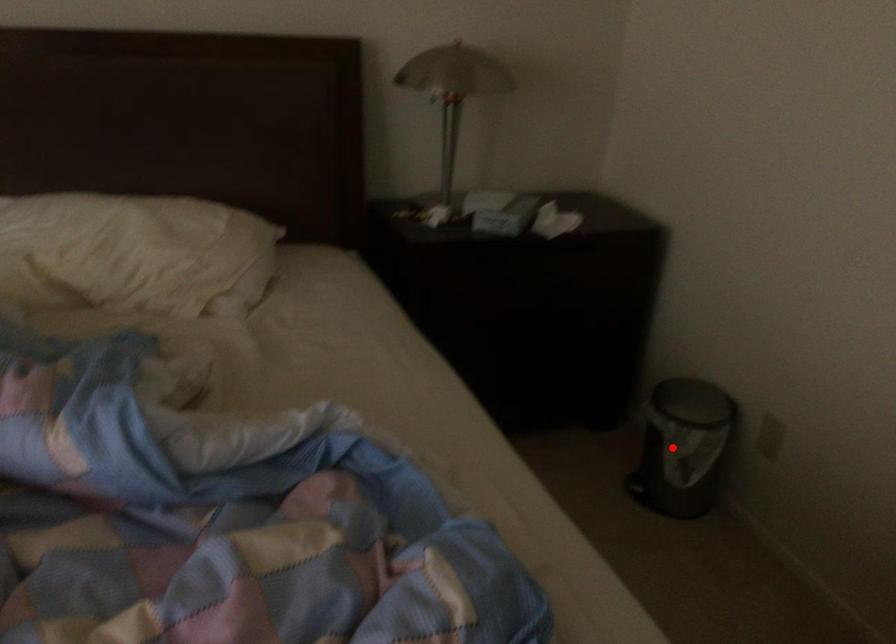
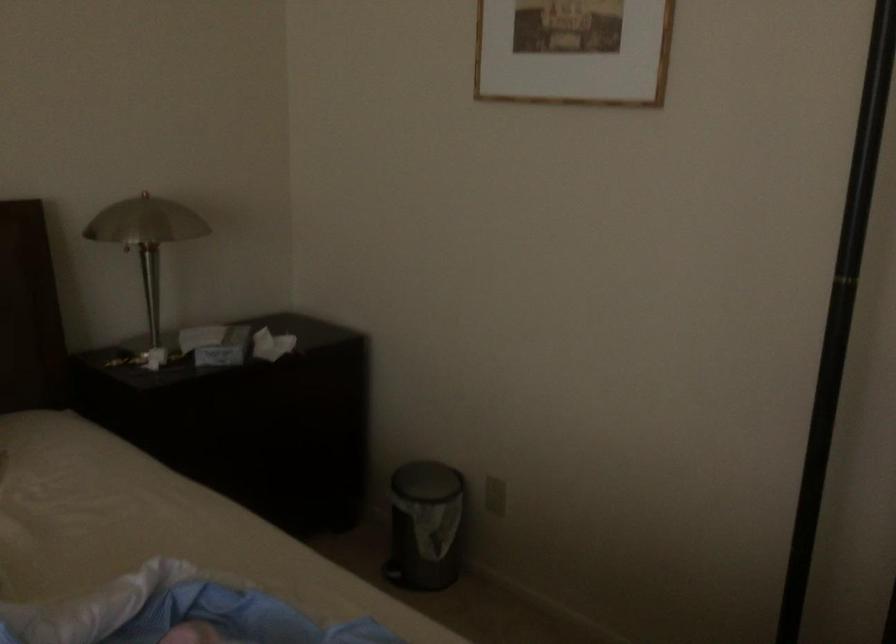
Question: A red point is marked in image1. In image2, is the corresponding 3D point closer to the camera or farther? Reply with the corresponding letter.

Choices:
 (A) The corresponding 3D point is closer.
 (B) The corresponding 3D point is farther.

Answer: (B)